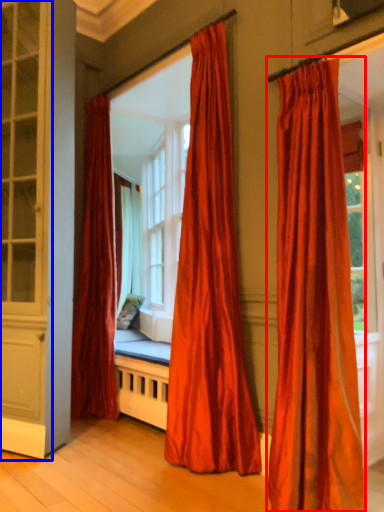
Question: Which point is further to the camera, curtain (highlighted by a red box) or screen door (highlighted by a blue box)?

Choices:
 (A) curtain
 (B) screen door

Answer: (B)